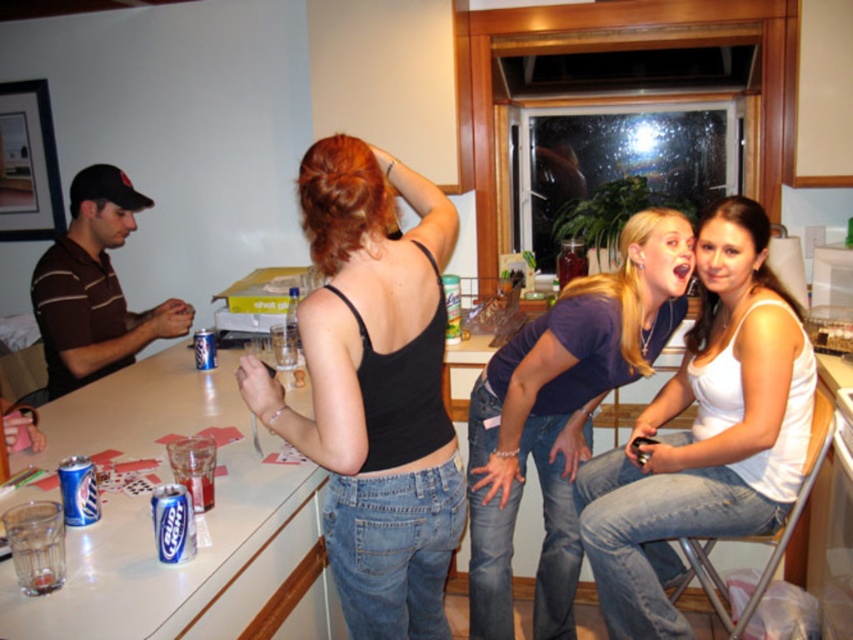
You are a photographer trying to capture a candid shot of the brown striped shirt at left and the transparent glass at lower left. Since the camera has a limited focus range, you need to know which object is wider to ensure proper framing. Which object has a greater width?

The brown striped shirt at left has a greater width than the transparent glass at lower left, so it should be framed accordingly.